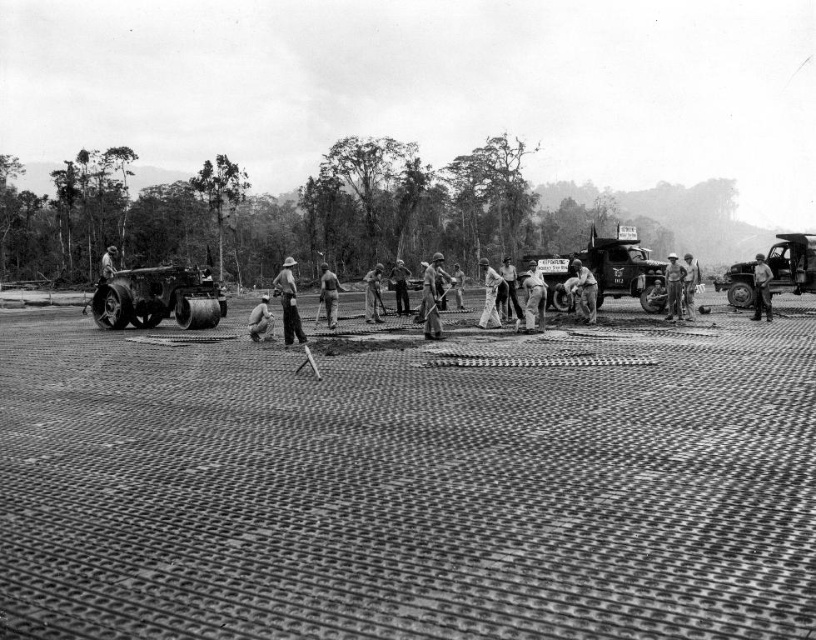
You are a soldier in the jungle and need to move a heavy supply crate. You see a matte black roller at left and a light brown uniform at center. Which object is smaller in size?

The matte black roller at left is smaller in size compared to the light brown uniform at center according to the description.

You are a soldier in the jungle and need to move equipment across the grid surface. You see a matte black roller at left and a light brown wooden shovel at center. Which tool should you use to flatten the raised bumps on the grid surface?

The matte black roller at left is to the left of the light brown wooden shovel at center. The roller is designed for flattening surfaces, so you should use the matte black roller at left to flatten the raised bumps on the grid surface.

You are a soldier in the scene and need to move from the matte black roller at left to the light brown uniform at center. Which direction should you move to reach your destination?

The matte black roller at left is positioned on the left side of the light brown uniform at center, so you should move to the right to reach the light brown uniform at center.